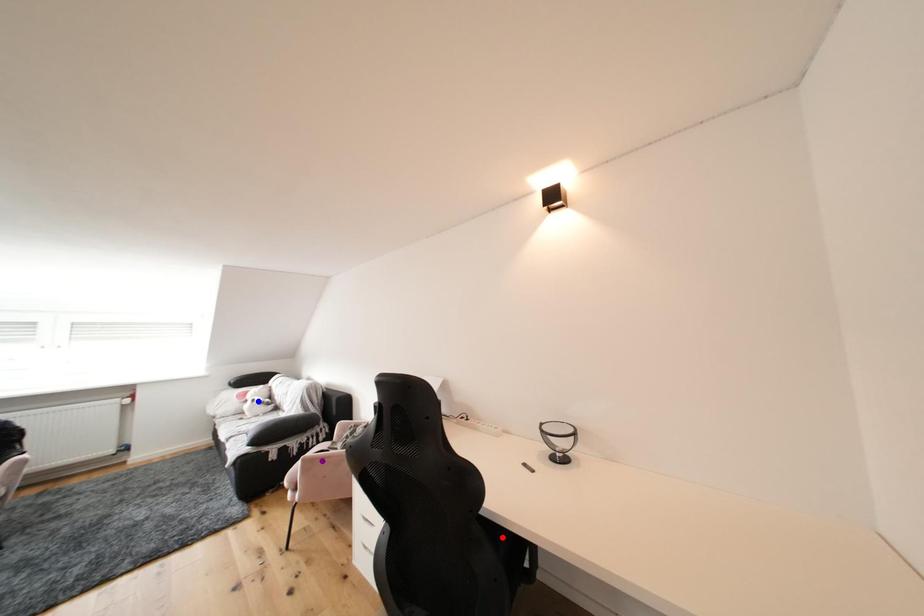
Order these from nearest to farthest:
A) purple point
B) blue point
C) red point

red point
purple point
blue point